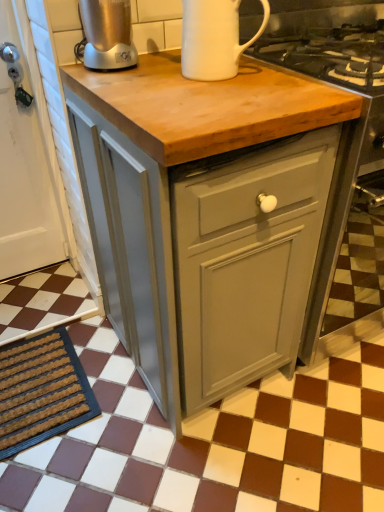
Question: Is white ceramic mug at upper center, the first kitchen appliance from the right, at the right side of matte gray cabinet at center?

Choices:
 (A) yes
 (B) no

Answer: (B)

Question: Is matte gray cabinet at center at the back of white ceramic mug at upper center, the 2th kitchen appliance when ordered from left to right?

Choices:
 (A) no
 (B) yes

Answer: (A)

Question: Can you confirm if white ceramic mug at upper center, the first kitchen appliance from the right, is thinner than matte gray cabinet at center?

Choices:
 (A) yes
 (B) no

Answer: (A)

Question: Is matte gray cabinet at center a part of white ceramic mug at upper center, the 2th kitchen appliance when ordered from left to right?

Choices:
 (A) no
 (B) yes

Answer: (A)

Question: Is white ceramic mug at upper center, the first kitchen appliance from the right, bigger than matte gray cabinet at center?

Choices:
 (A) no
 (B) yes

Answer: (A)

Question: Considering the positions of point (324, 495) and point (296, 346), is point (324, 495) closer or farther from the camera than point (296, 346)?

Choices:
 (A) closer
 (B) farther

Answer: (A)

Question: Is brown checkered tile at center to the left or to the right of matte gray cabinet at center in the image?

Choices:
 (A) left
 (B) right

Answer: (A)

Question: From a real-world perspective, is brown checkered tile at center physically located above or below matte gray cabinet at center?

Choices:
 (A) below
 (B) above

Answer: (A)

Question: In the image, is brown checkered tile at center positioned in front of or behind matte gray cabinet at center?

Choices:
 (A) behind
 (B) front

Answer: (B)

Question: Relative to white ceramic mug at upper center, the 2th kitchen appliance when ordered from left to right, is brushed metal blender at upper left, which is the 1th kitchen appliance from left to right, in front or behind?

Choices:
 (A) front
 (B) behind

Answer: (B)

Question: Considering the positions of point (92, 62) and point (213, 39), is point (92, 62) closer or farther from the camera than point (213, 39)?

Choices:
 (A) closer
 (B) farther

Answer: (B)

Question: Considering the positions of brushed metal blender at upper left, the second kitchen appliance from the right, and white ceramic mug at upper center, the first kitchen appliance from the right, in the image, is brushed metal blender at upper left, the second kitchen appliance from the right, bigger or smaller than white ceramic mug at upper center, the first kitchen appliance from the right,?

Choices:
 (A) big
 (B) small

Answer: (B)

Question: Is brushed metal blender at upper left, which is the 1th kitchen appliance from left to right, taller or shorter than white ceramic mug at upper center, the 2th kitchen appliance when ordered from left to right?

Choices:
 (A) tall
 (B) short

Answer: (A)

Question: In the image, is brown textured mat at lower left positioned in front of or behind matte gray cabinet at center?

Choices:
 (A) behind
 (B) front

Answer: (A)

Question: Considering the positions of point (39, 360) and point (196, 192), is point (39, 360) closer or farther from the camera than point (196, 192)?

Choices:
 (A) farther
 (B) closer

Answer: (A)